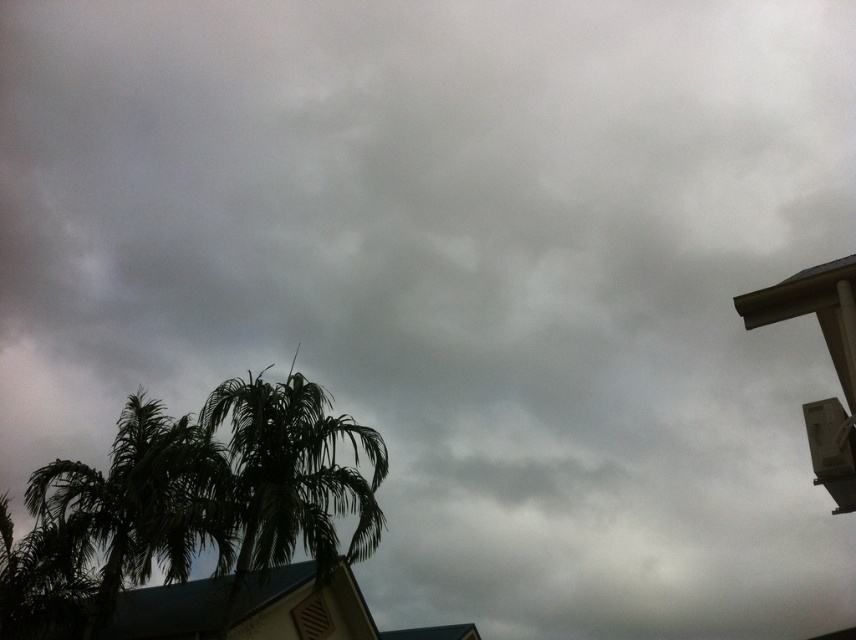
Question: Which of the following is the closest to the observer?

Choices:
 (A) dark green leafy tree at lower left
 (B) green leafy palm tree at center

Answer: (A)

Question: Is dark green leafy tree at lower left below green leafy palm tree at center?

Choices:
 (A) no
 (B) yes

Answer: (B)

Question: Which point is farther to the camera?

Choices:
 (A) (158, 461)
 (B) (345, 428)

Answer: (B)

Question: Can you confirm if dark green leafy tree at lower left is positioned above green leafy palm tree at center?

Choices:
 (A) no
 (B) yes

Answer: (A)

Question: Can you confirm if dark green leafy tree at lower left is positioned below green leafy palm tree at center?

Choices:
 (A) no
 (B) yes

Answer: (B)